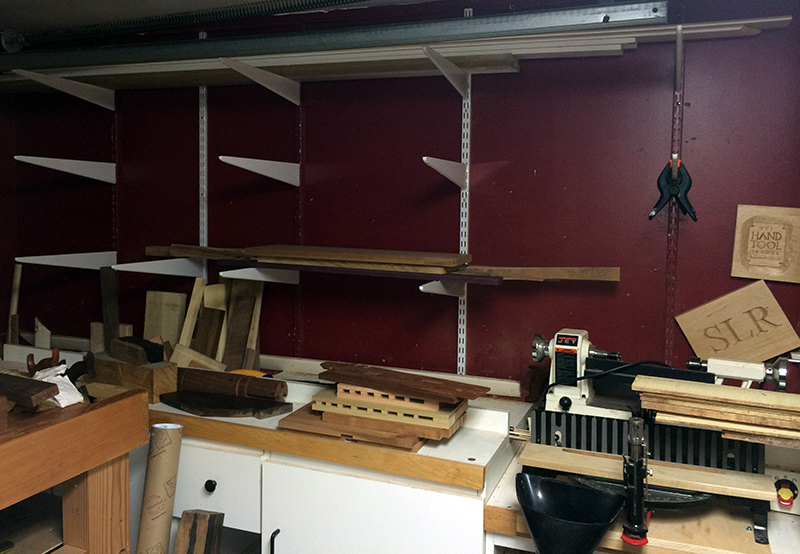
Where is `drawer knob`? The width and height of the screenshot is (800, 554). drawer knob is located at coordinates (209, 485).